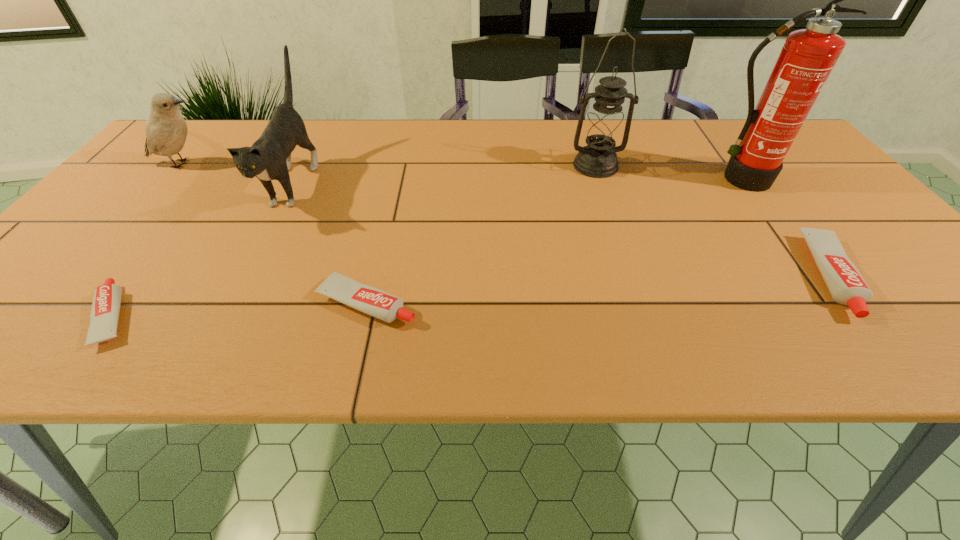
Where is `empty location between the tallest object and the tallest toothpaste`? Image resolution: width=960 pixels, height=540 pixels. empty location between the tallest object and the tallest toothpaste is located at coordinates (786, 228).

Where is `empty space between the tallest object and the third tallest object`? empty space between the tallest object and the third tallest object is located at coordinates (516, 180).

Point out which object is positioned as the sixth nearest to the oil lamp. Please provide its 2D coordinates. Your answer should be formatted as a tuple, i.e. [(x, y)], where the tuple contains the x and y coordinates of a point satisfying the conditions above.

[(166, 130)]

Locate an element on the screen. the fifth closest object to the oil lamp is located at coordinates (105, 309).

The image size is (960, 540). What are the coordinates of `toothpaste that is the closest one to the fifth tallest object` in the screenshot? It's located at (377, 303).

Where is `toothpaste that stands as the second closest to the fourth shortest object`? toothpaste that stands as the second closest to the fourth shortest object is located at coordinates tap(377, 303).

In order to click on vacant space that satisfies the following two spatial constraints: 1. on the front-facing side of the tallest object; 2. on the left side of the tallest toothpaste in this screenshot , I will do `click(809, 276)`.

The height and width of the screenshot is (540, 960). I want to click on vacant space that satisfies the following two spatial constraints: 1. at the beak of the shortest toothpaste; 2. on the left side of the bird, so click(x=51, y=316).

Where is `free space that satisfies the following two spatial constraints: 1. at the beak of the fourth shortest object; 2. on the back side of the rightmost toothpaste`? free space that satisfies the following two spatial constraints: 1. at the beak of the fourth shortest object; 2. on the back side of the rightmost toothpaste is located at coordinates (85, 276).

This screenshot has width=960, height=540. What are the coordinates of `free space in the image that satisfies the following two spatial constraints: 1. at the beak of the second tallest object; 2. on the right side of the fourth tallest object` in the screenshot? It's located at coord(181,166).